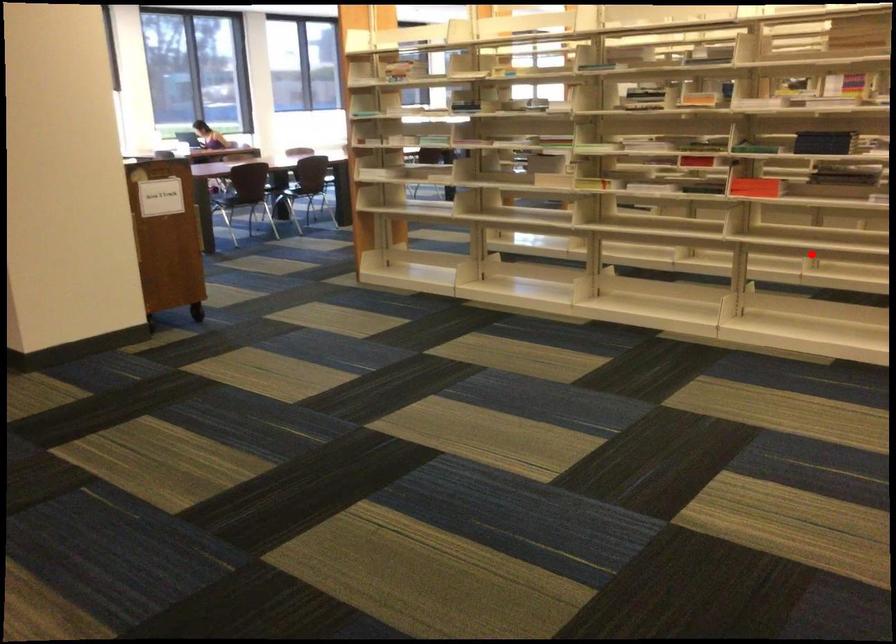
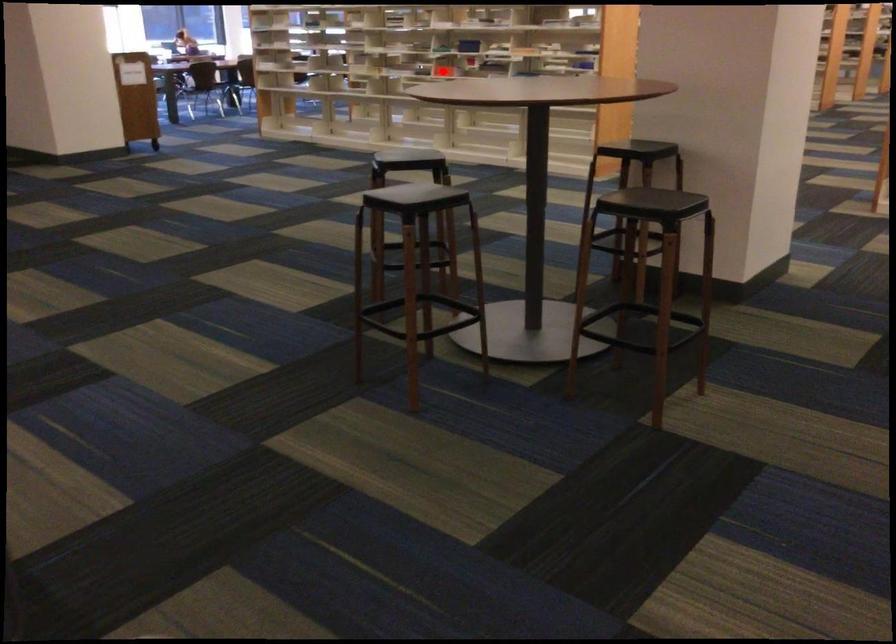
I am providing you with two images of the same scene from different viewpoints. A red point is marked on the first image and another point is marked on the second image. Is the red point in image1 aligned with the point shown in image2?

Yes